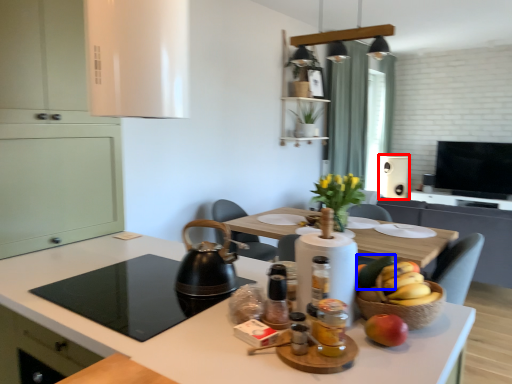
Question: Among these objects, which one is farthest to the camera, appliance (highlighted by a red box) or fruit (highlighted by a blue box)?

Choices:
 (A) appliance
 (B) fruit

Answer: (A)